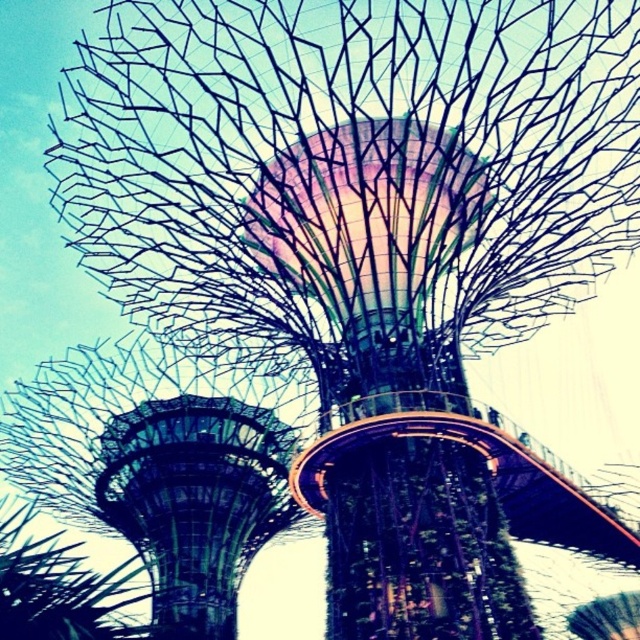
You are standing in front of the Supertree Grove and notice both the green glass tower at lower left and the metallic wireframe tree at lower left. Which of these two objects is closer to you?

The green glass tower at lower left is closer to you because the metallic wireframe tree at lower left is positioned behind it.

You are a visitor standing in front of the Supertree Grove and notice the green glass tower at lower left and the metallic wireframe tree at lower left. Which object is bigger in size?

The green glass tower at lower left is larger in size compared to the metallic wireframe tree at lower left according to the description.

Consider the image. You are a visitor at Gardens by the Bay and want to take a photo of both the green glass tower at lower left and the metallic wireframe tree at lower left. If your camera can capture a maximum distance of 15 meters between objects, will you be able to include both in the same frame?

The distance between the green glass tower at lower left and the metallic wireframe tree at lower left is 12.49 meters, which is within the camera maximum distance of 15 meters. Therefore, both objects can be captured in the same frame.